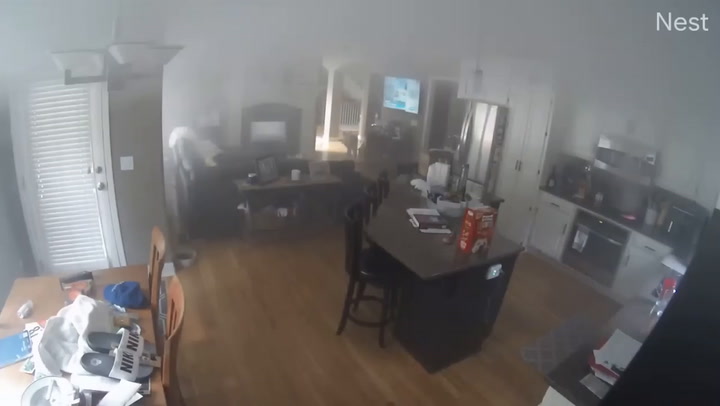
Find the location of a particular element. This screenshot has height=406, width=720. chair is located at coordinates coord(376,284).